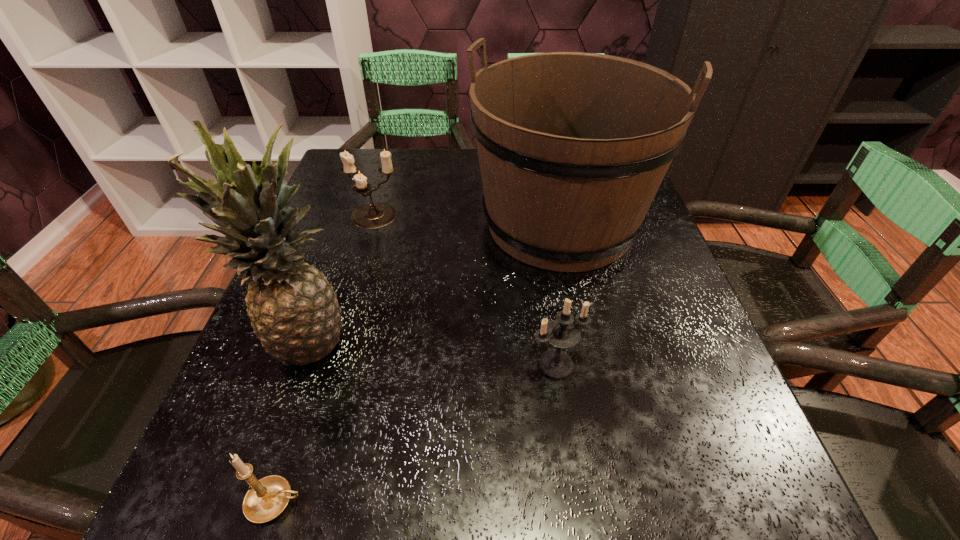
The image size is (960, 540). Find the location of `pineapple`. pineapple is located at coordinates (293, 309).

Find the location of a particular element. bucket is located at coordinates (573, 147).

Where is `the farthest candle holder`? Image resolution: width=960 pixels, height=540 pixels. the farthest candle holder is located at coordinates (373, 215).

Where is `the second farthest candle holder`? the second farthest candle holder is located at coordinates (561, 333).

The image size is (960, 540). What are the coordinates of `the nearest candle holder` in the screenshot? It's located at (267, 498).

Find the location of a particular element. vacant area situated on the right of the pineapple is located at coordinates (446, 341).

The height and width of the screenshot is (540, 960). Find the location of `vacant space positioned on the left of the bucket`. vacant space positioned on the left of the bucket is located at coordinates (348, 224).

Identify the location of vacant position located on the front of the farthest candle holder. (361, 260).

At what (x,y) coordinates should I click in order to perform the action: click on free location located 0.290m on the back of the rightmost candle holder. Please return your answer as a coordinate pair (x, y). Looking at the image, I should click on (539, 242).

The width and height of the screenshot is (960, 540). What are the coordinates of `vacant area located on the handle side of the nearest candle holder` in the screenshot? It's located at (562, 502).